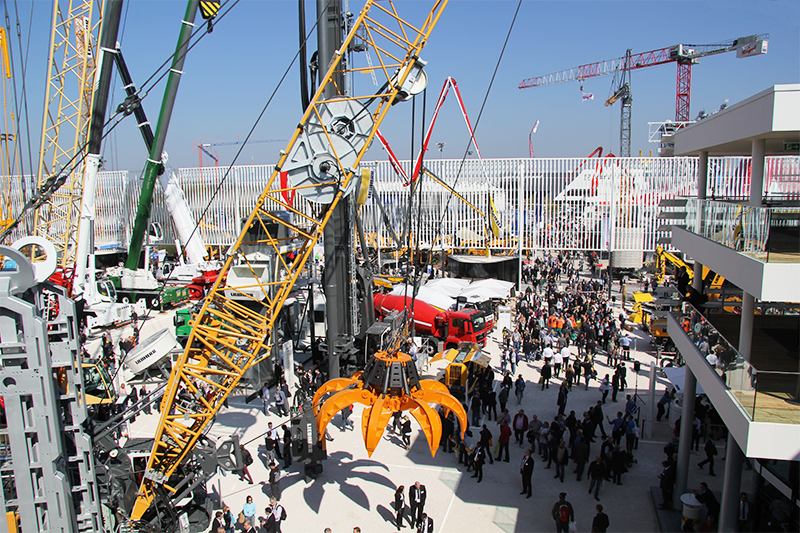
Identify the location of transparent wall panel. (717, 353).